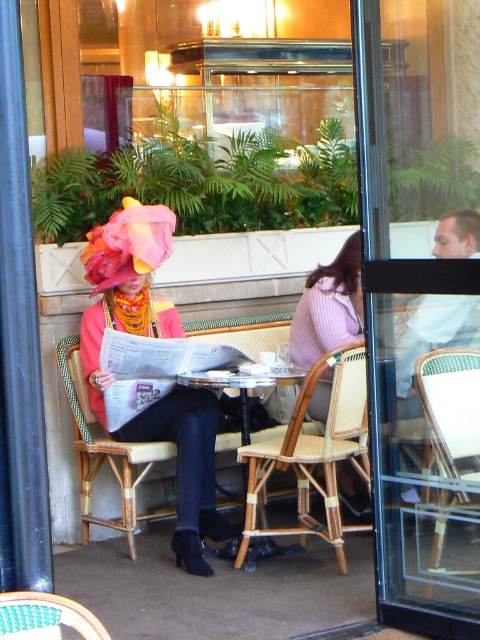
You are a photographer trying to capture the woman in the pink fabric hat at center without including the woven rattan chair at center in the frame. Is this possible given their positions?

The woven rattan chair at center is positioned under the pink fabric hat at center, so the hat is above the chair. Since the hat is above the chair, it might be possible to angle the camera downward to capture the hat without including the chair in the frame.

You are standing at the center of the scene and want to walk to both points. Which point should you reach first, point (241, 561) or point (476, 369)?

Point (476, 369) should be reached first because it is in front of point (241, 561), so you would encounter it sooner while moving forward.